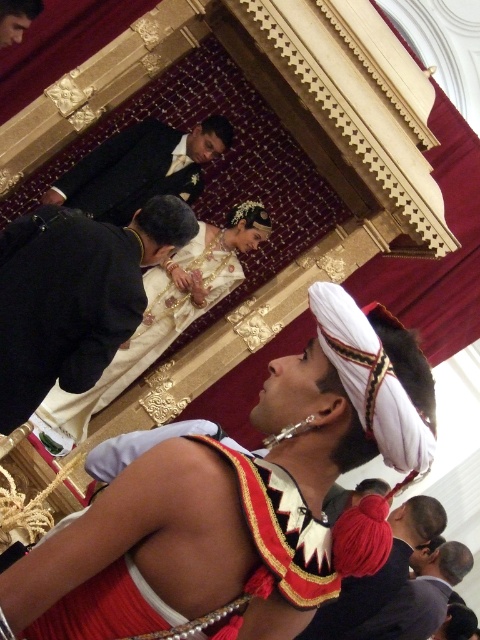
You are a guest at the event and need to locate the black velvet suit at upper left. According to the coordinates provided, where exactly should you look to find it?

The black velvet suit at upper left is located at coordinates point (74,298).

You are a photographer planning to capture the ceremonial scene. You need to decide where to place your camera to ensure both the black velvet suit at upper left and the red velvet turban at center are fully visible in the frame. Considering their sizes, which object should you prioritize framing first?

The black velvet suit at upper left occupies less space than the red velvet turban at center, so you should prioritize framing the red velvet turban at center first to ensure it fits properly in the camera frame.

You are a photographer standing at the back of the venue. You need to take a photo of both the black velvet suit at upper left and the dark suit at center. Given that your camera has a maximum focus range of 18 meters, will you be able to capture both subjects clearly in the same frame?

The distance between the black velvet suit at upper left and the dark suit at center is 17.92 meters, which is within the camera maximum focus range of 18 meters. Yes, you can capture both subjects clearly in the same frame.